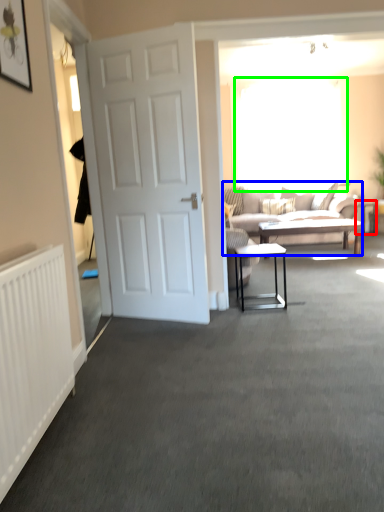
Question: Which object is the farthest from side table (highlighted by a red box)? Choose among these: studio couch (highlighted by a blue box) or window screen (highlighted by a green box).

Choices:
 (A) studio couch
 (B) window screen

Answer: (B)